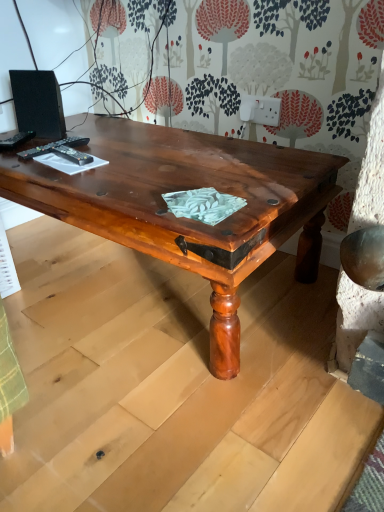
Question: Is black matte speaker at upper left further to camera compared to black plastic remote control at upper left, which ranks as the 2th remote control in left-to-right order?

Choices:
 (A) yes
 (B) no

Answer: (A)

Question: Does black matte speaker at upper left have a larger size compared to black plastic remote control at upper left, which ranks as the 2th remote control in left-to-right order?

Choices:
 (A) no
 (B) yes

Answer: (B)

Question: From the image's perspective, does black matte speaker at upper left appear higher than black plastic remote control at upper left, the second remote control in the right-to-left sequence?

Choices:
 (A) no
 (B) yes

Answer: (B)

Question: Does black matte speaker at upper left come in front of black plastic remote control at upper left, the second remote control in the right-to-left sequence?

Choices:
 (A) yes
 (B) no

Answer: (B)

Question: Does black matte speaker at upper left have a lesser height compared to black plastic remote control at upper left, which ranks as the 2th remote control in left-to-right order?

Choices:
 (A) yes
 (B) no

Answer: (B)

Question: In terms of width, does black plastic remote control at upper left, acting as the third remote control starting from the right, look wider or thinner when compared to black matte speaker at upper left?

Choices:
 (A) wide
 (B) thin

Answer: (A)

Question: Considering the positions of black plastic remote control at upper left, the first remote control in the left-to-right sequence, and black matte speaker at upper left in the image, is black plastic remote control at upper left, the first remote control in the left-to-right sequence, taller or shorter than black matte speaker at upper left?

Choices:
 (A) short
 (B) tall

Answer: (A)

Question: From a real-world perspective, is black plastic remote control at upper left, acting as the third remote control starting from the right, positioned above or below black matte speaker at upper left?

Choices:
 (A) above
 (B) below

Answer: (B)

Question: Is black plastic remote control at upper left, the first remote control in the left-to-right sequence, bigger or smaller than black matte speaker at upper left?

Choices:
 (A) big
 (B) small

Answer: (B)

Question: From a real-world perspective, is black plastic remote control at upper left, which ranks as the 2th remote control in left-to-right order, positioned above or below black matte speaker at upper left?

Choices:
 (A) above
 (B) below

Answer: (B)

Question: Is point click(x=29, y=148) closer or farther from the camera than point click(x=33, y=98)?

Choices:
 (A) closer
 (B) farther

Answer: (A)

Question: Is black plastic remote control at upper left, the second remote control in the right-to-left sequence, to the left or to the right of black matte speaker at upper left in the image?

Choices:
 (A) left
 (B) right

Answer: (B)

Question: Is black plastic remote control at upper left, which ranks as the 2th remote control in left-to-right order, inside the boundaries of black matte speaker at upper left, or outside?

Choices:
 (A) inside
 (B) outside

Answer: (B)

Question: Relative to black plastic remote control at upper left, acting as the third remote control starting from the right, is black plastic remote control at upper left, the 3th remote control viewed from the left, in front or behind?

Choices:
 (A) front
 (B) behind

Answer: (A)

Question: From a real-world perspective, is black plastic remote control at upper left, positioned as the 1th remote control in right-to-left order, physically located above or below black plastic remote control at upper left, the first remote control in the left-to-right sequence?

Choices:
 (A) above
 (B) below

Answer: (A)